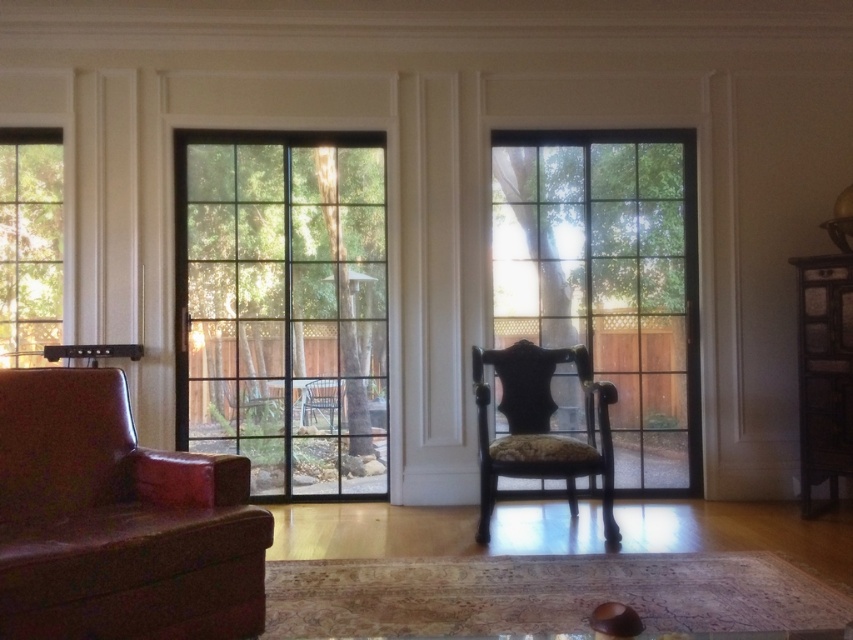
Consider the image. You are a delivery person trying to bring a large sofa through the clear glass window at left into the room. The sofa is as wide as the leather armchair at left. Will the sofa fit through the window?

The leather armchair at left might be wider than clear glass window at left, so the sofa, being as wide as the leather armchair at left, might not fit through the clear glass window at left.

You are moving a large painting that is 1.5 meters wide. You want to hang it on the wall between the leather armchair at left and the wooden cabinet at right. Is there enough space between them to fit the painting?

The leather armchair at left is to the left of wooden cabinet at right, so the distance between them is sufficient to accommodate the 1.5 meter wide painting.

You are planning to move a new sofa that is 2 meters wide into this room. The sofa must be placed between the leather armchair at left and the wooden cabinet at right. Based on the space between these two objects, will the sofa fit?

The leather armchair at left is wider than the wooden cabinet at right. However, the exact distance between them isn not provided, so we cannot determine if the sofa will fit. More information is needed.